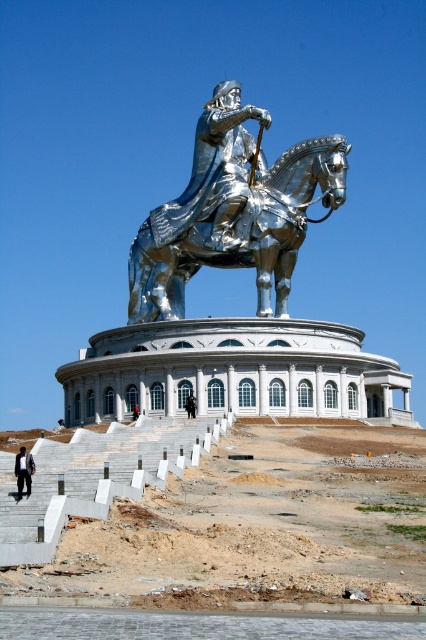
Question: Can you confirm if shiny chrome horse at center is positioned below brushed metal helmet at upper center?

Choices:
 (A) yes
 (B) no

Answer: (B)

Question: Which point appears closest to the camera in this image?

Choices:
 (A) (290, 166)
 (B) (213, 349)
 (C) (189, 416)

Answer: (C)

Question: Is shiny chrome horse at center smaller than brushed metal helmet at upper center?

Choices:
 (A) yes
 (B) no

Answer: (B)

Question: Based on their relative distances, which object is nearer to the black suit at lower left?

Choices:
 (A) white marble palace at center
 (B) shiny chrome horse at center
 (C) dark brown leather coat at center
 (D) brushed metal helmet at upper center

Answer: (A)

Question: Is shiny chrome horse at center above black suit at lower left?

Choices:
 (A) yes
 (B) no

Answer: (A)

Question: Based on their relative distances, which object is nearer to the dark brown leather coat at center?

Choices:
 (A) black suit at lower left
 (B) shiny chrome horse at center
 (C) white marble palace at center
 (D) brushed metal helmet at upper center

Answer: (D)